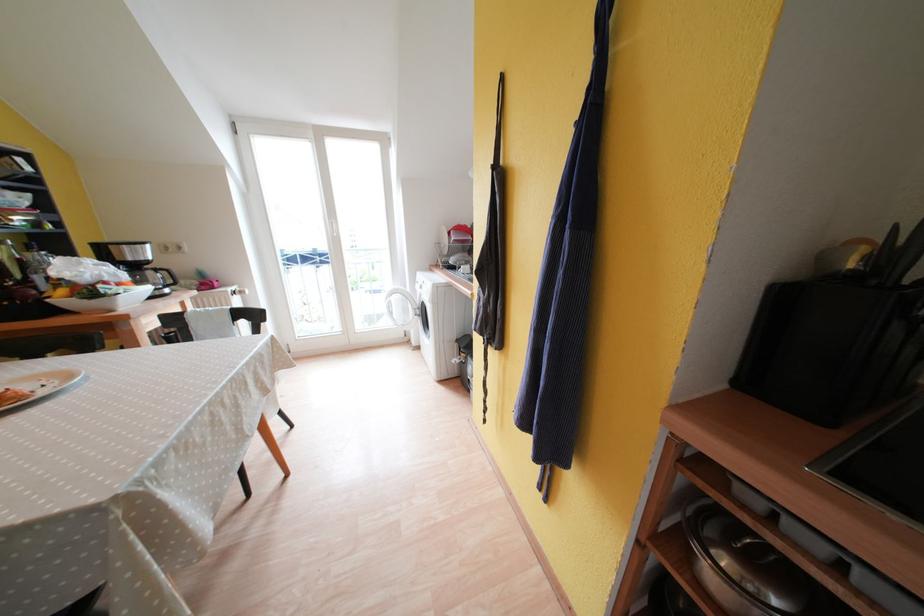
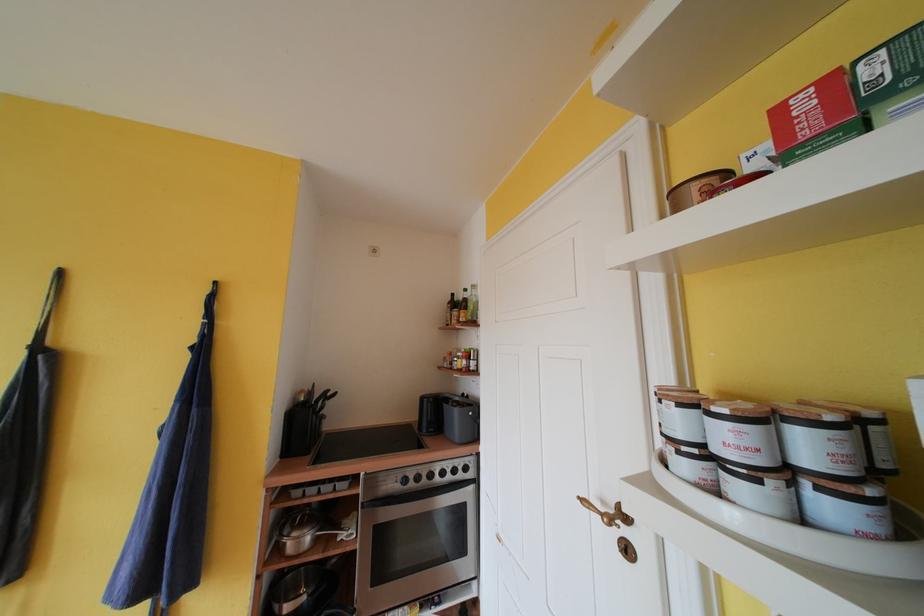
In the second image, find the point that corresponds to point (715, 533) in the first image.

(293, 535)